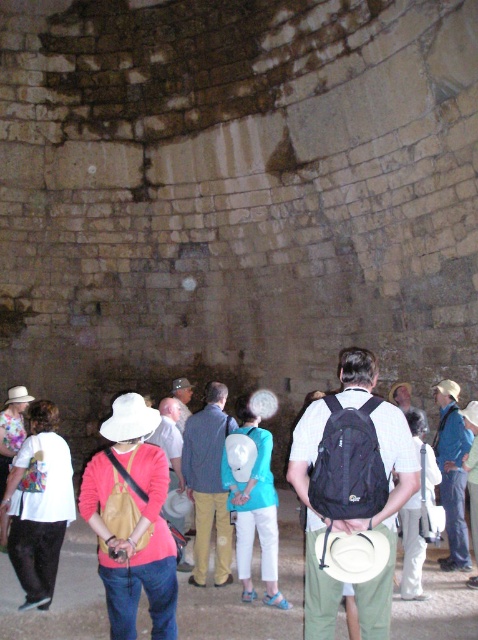
You are standing at point 0.0, 0.0 in the ancient stone structure. You need to move to the black fabric backpack at center located at point (350,488). What direction should you move in to reach it?

The black fabric backpack at center is located at point (350,488), so you should move northeast to reach it.

Looking at this image, you are an archaeologist examining the ancient stone structure. You notice a white cotton hat at lower left and a blue denim shirt at center. Which object is bigger in size?

The white cotton hat at lower left has a larger size compared to the blue denim shirt at center.